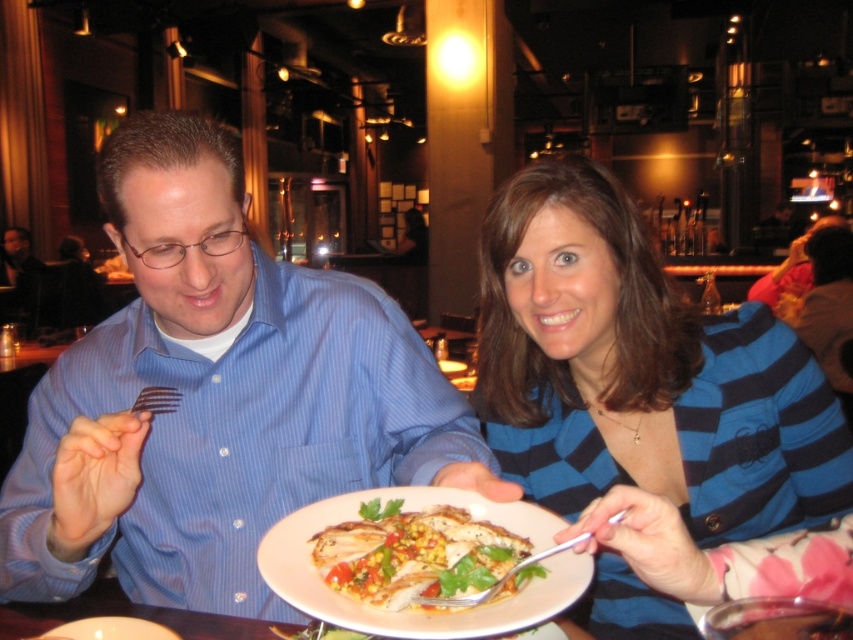
Who is positioned more to the right, blue striped shirt at center or golden crispy chicken at center?

From the viewer's perspective, golden crispy chicken at center appears more on the right side.

Who is more distant from viewer, (213, 500) or (351, 579)?

The point (213, 500) is behind.

What are the coordinates of `blue striped shirt at center` in the screenshot? It's located at (216, 397).

Is golden crispy chicken at center further to the viewer compared to silver metallic fork at plate center?

Yes, golden crispy chicken at center is further from the viewer.

Who is more distant from viewer, (495, 529) or (548, 556)?

Positioned behind is point (495, 529).

Based on the photo, who is more distant from viewer, (387, 577) or (492, 589)?

The point (387, 577) is more distant.

The width and height of the screenshot is (853, 640). What are the coordinates of `golden crispy chicken at center` in the screenshot? It's located at (416, 556).

Does blue striped sweater at center have a larger size compared to silver metallic fork at plate center?

Correct, blue striped sweater at center is larger in size than silver metallic fork at plate center.

Who is taller, blue striped sweater at center or silver metallic fork at plate center?

blue striped sweater at center is taller.

Between point (541, 348) and point (506, 573), which one is positioned in front?

Point (506, 573)

This screenshot has width=853, height=640. I want to click on blue striped sweater at center, so click(641, 396).